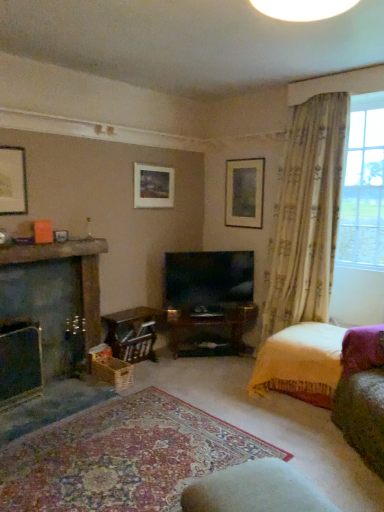
Question: Is matte wooden picture frame at upper center, acting as the 3th picture frame starting from the front, wider or thinner than flat-screen tv at center?

Choices:
 (A) wide
 (B) thin

Answer: (B)

Question: From the image's perspective, is matte wooden picture frame at upper center, placed as the 3th picture frame when sorted from left to right, located above or below flat-screen tv at center?

Choices:
 (A) below
 (B) above

Answer: (B)

Question: Which of these objects is positioned closest to the white fabric rocking chair at lower center?

Choices:
 (A) translucent floral curtains at right
 (B) flat-screen tv at center
 (C) matte black fireplace at left, which is the 1th fireplace from front to back
 (D) matte black picture frame at upper left, the first picture frame when ordered from left to right
 (E) floral fabric curtain at right

Answer: (C)

Question: Which is nearer to the matte gold picture frame at upper center, the second picture frame when ordered from right to left?

Choices:
 (A) flat-screen tv at center
 (B) matte black fireplace at left, which is the 1th fireplace from front to back
 (C) floral fabric curtain at right
 (D) wooden crate at lower center
 (E) velvet yellow bed at lower right

Answer: (A)